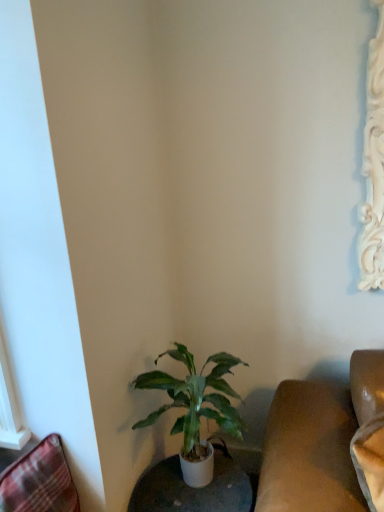
Question: Can you confirm if green matte plant at lower center is positioned to the right of white glossy round table at lower center?

Choices:
 (A) no
 (B) yes

Answer: (B)

Question: Does green matte plant at lower center have a greater height compared to white glossy round table at lower center?

Choices:
 (A) no
 (B) yes

Answer: (B)

Question: Is green matte plant at lower center wider than white glossy round table at lower center?

Choices:
 (A) yes
 (B) no

Answer: (A)

Question: Is green matte plant at lower center far from white glossy round table at lower center?

Choices:
 (A) yes
 (B) no

Answer: (B)

Question: From a real-world perspective, is green matte plant at lower center over white glossy round table at lower center?

Choices:
 (A) no
 (B) yes

Answer: (B)

Question: Does green matte plant at lower center have a lesser width compared to white glossy round table at lower center?

Choices:
 (A) no
 (B) yes

Answer: (A)

Question: Is green matte plant at lower center outside plaid fabric swivel chair at lower left?

Choices:
 (A) no
 (B) yes

Answer: (B)

Question: Is plaid fabric swivel chair at lower left inside green matte plant at lower center?

Choices:
 (A) yes
 (B) no

Answer: (B)

Question: Considering the relative sizes of green matte plant at lower center and plaid fabric swivel chair at lower left in the image provided, is green matte plant at lower center smaller than plaid fabric swivel chair at lower left?

Choices:
 (A) no
 (B) yes

Answer: (A)

Question: Is green matte plant at lower center turned away from plaid fabric swivel chair at lower left?

Choices:
 (A) no
 (B) yes

Answer: (A)

Question: Is green matte plant at lower center aimed at plaid fabric swivel chair at lower left?

Choices:
 (A) no
 (B) yes

Answer: (A)

Question: Considering the relative sizes of green matte plant at lower center and plaid fabric swivel chair at lower left in the image provided, is green matte plant at lower center taller than plaid fabric swivel chair at lower left?

Choices:
 (A) no
 (B) yes

Answer: (B)

Question: Does plaid fabric swivel chair at lower left have a greater height compared to green matte plant at lower center?

Choices:
 (A) no
 (B) yes

Answer: (A)